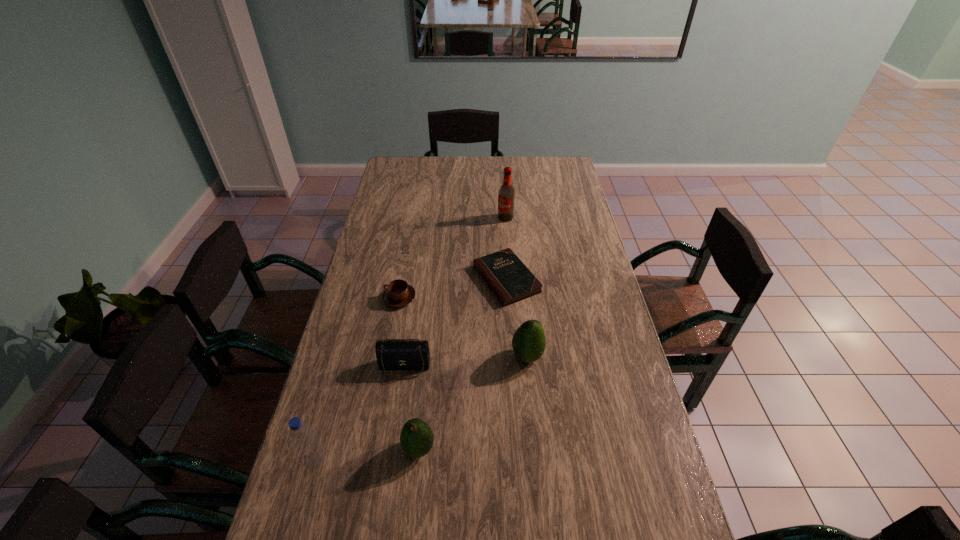
Locate an element on the screen. This screenshot has width=960, height=540. clutch bag present at the left edge is located at coordinates (392, 354).

Image resolution: width=960 pixels, height=540 pixels. Identify the location of bottle that is at the left edge. (311, 454).

In the image, there is a desktop. Identify the location of free space at the far edge. The width and height of the screenshot is (960, 540). (438, 175).

Identify the location of vacant area at the near edge. (519, 535).

In the image, there is a desktop. In order to click on vacant area at the left edge in this screenshot , I will do 364,450.

Locate an element on the screen. vacant area at the right edge of the desktop is located at coordinates (604, 359).

Where is `free spot between the shortest object and the fifth tallest object`? free spot between the shortest object and the fifth tallest object is located at coordinates (455, 323).

Where is `unoccupied area between the fifth tallest object and the beer bottle`? unoccupied area between the fifth tallest object and the beer bottle is located at coordinates (455, 293).

The image size is (960, 540). Identify the location of free space between the cappuccino and the bottle. (357, 379).

At what (x,y) coordinates should I click in order to perform the action: click on free space between the leftmost object and the clutch bag. Please return your answer as a coordinate pair (x, y). Image resolution: width=960 pixels, height=540 pixels. Looking at the image, I should click on (360, 414).